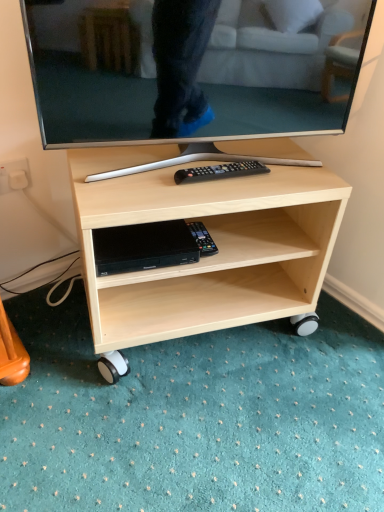
At what (x,y) coordinates should I click in order to perform the action: click on matte black tv at center. Please return your answer as a coordinate pair (x, y). Looking at the image, I should click on (192, 78).

The width and height of the screenshot is (384, 512). What do you see at coordinates (192, 78) in the screenshot?
I see `matte black tv at center` at bounding box center [192, 78].

Describe the element at coordinates (207, 257) in the screenshot. I see `light wood/texture tv stand at center` at that location.

Identify the location of black plastic dvd player at lower center. (143, 247).

Locate an element on the screen. This screenshot has height=512, width=384. matte black tv at center is located at coordinates (192, 78).

Is black plastic dvd player at lower center in front of light wood/texture tv stand at center?

No, the depth of black plastic dvd player at lower center is greater than that of light wood/texture tv stand at center.

Which of these two, black plastic dvd player at lower center or light wood/texture tv stand at center, is bigger?

With larger size is light wood/texture tv stand at center.

Which is more to the left, black plastic dvd player at lower center or light wood/texture tv stand at center?

From the viewer's perspective, black plastic dvd player at lower center appears more on the left side.

Is black plastic remote control at center positioned far away from light wood/texture tv stand at center?

No, there isn't a large distance between black plastic remote control at center and light wood/texture tv stand at center.

From the image's perspective, is black plastic remote control at center on top of light wood/texture tv stand at center?

Yes, from the image's perspective, black plastic remote control at center is over light wood/texture tv stand at center.

Which object is more forward, black plastic remote control at center or light wood/texture tv stand at center?

light wood/texture tv stand at center.

Looking at this image, how many degrees apart are the facing directions of black plastic remote control at center and light wood/texture tv stand at center?

The angle between the facing direction of black plastic remote control at center and the facing direction of light wood/texture tv stand at center is 0.000186 degrees.

Which is behind, point (305, 252) or point (103, 251)?

The point (305, 252) is farther from the camera.

Which is in front, light wood/texture tv stand at center or black plastic dvd player at lower center?

light wood/texture tv stand at center is closer to the camera.

Can you confirm if light wood/texture tv stand at center is shorter than black plastic dvd player at lower center?

In fact, light wood/texture tv stand at center may be taller than black plastic dvd player at lower center.

Which object is further away from the camera taking this photo, light wood/texture tv stand at center or matte black tv at center?

Positioned behind is light wood/texture tv stand at center.

Is matte black tv at center at the back of light wood/texture tv stand at center?

No, matte black tv at center is not at the back of light wood/texture tv stand at center.

What's the angular difference between light wood/texture tv stand at center and matte black tv at center's facing directions?

There is a 3.55-degree angle between the facing directions of light wood/texture tv stand at center and matte black tv at center.

Which is closer to the camera, (140, 178) or (110, 126)?

The point (140, 178) is closer to the camera.

Is black plastic remote at center inside or outside of light wood/texture tv stand at center?

black plastic remote at center is inside light wood/texture tv stand at center.

Could you tell me if black plastic remote at center is facing light wood/texture tv stand at center?

Yes, black plastic remote at center is turned towards light wood/texture tv stand at center.

From the image's perspective, is black plastic remote at center located beneath light wood/texture tv stand at center?

Incorrect, from the image's perspective, black plastic remote at center is higher than light wood/texture tv stand at center.

Which object is further away from the camera, matte black tv at center or black plastic dvd player at lower center?

black plastic dvd player at lower center is more distant.

Which point is more forward, (45, 8) or (172, 237)?

The point (45, 8) is more forward.

Is matte black tv at center next to black plastic dvd player at lower center and touching it?

There is a gap between matte black tv at center and black plastic dvd player at lower center.

Is matte black tv at center positioned beyond the bounds of black plastic dvd player at lower center?

Yes, matte black tv at center is located beyond the bounds of black plastic dvd player at lower center.

From a real-world perspective, is matte black tv at center located beneath black plastic remote at center?

No.

From the image's perspective, which one is positioned lower, matte black tv at center or black plastic remote at center?

black plastic remote at center is shown below in the image.

The height and width of the screenshot is (512, 384). What are the coordinates of `television located above the black plastic remote at center (from the image's perspective)` in the screenshot? It's located at (192, 78).

Locate an element on the screen. This screenshot has width=384, height=512. gadget lying on the left of light wood/texture tv stand at center is located at coordinates (143, 247).

Locate an element on the screen. The height and width of the screenshot is (512, 384). desk below the black plastic remote control at center (from a real-world perspective) is located at coordinates (207, 257).

Based on their spatial positions, is black plastic remote control at center or light wood/texture tv stand at center further from black plastic remote at center?

light wood/texture tv stand at center is positioned further to the anchor black plastic remote at center.

Consider the image. Looking at the image, which one is located further to black plastic remote control at center, black plastic dvd player at lower center or black plastic remote at center?

black plastic remote at center is further to black plastic remote control at center.

Which object lies further to the anchor point black plastic remote at center, black plastic dvd player at lower center or matte black tv at center?

matte black tv at center is further to black plastic remote at center.

From the image, which object appears to be nearer to light wood/texture tv stand at center, matte black tv at center or black plastic remote at center?

Based on the image, matte black tv at center appears to be nearer to light wood/texture tv stand at center.

Estimate the real-world distances between objects in this image. Which object is further from black plastic remote control at center, light wood/texture tv stand at center or black plastic dvd player at lower center?

The object further to black plastic remote control at center is light wood/texture tv stand at center.

Based on their spatial positions, is black plastic remote control at center or matte black tv at center further from black plastic remote at center?

Based on the image, matte black tv at center appears to be further to black plastic remote at center.

Considering their positions, is black plastic remote at center positioned closer to black plastic dvd player at lower center than light wood/texture tv stand at center?

light wood/texture tv stand at center.

Based on their spatial positions, is black plastic remote at center or light wood/texture tv stand at center further from black plastic remote control at center?

light wood/texture tv stand at center is positioned further to the anchor black plastic remote control at center.

Where is `equipment between black plastic dvd player at lower center and black plastic remote at center from left to right`? Image resolution: width=384 pixels, height=512 pixels. equipment between black plastic dvd player at lower center and black plastic remote at center from left to right is located at coordinates (202, 239).

Identify the location of desk between black plastic dvd player at lower center and black plastic remote at center. This screenshot has width=384, height=512. (207, 257).

Where is `remote that lies between matte black tv at center and light wood/texture tv stand at center from top to bottom`? Image resolution: width=384 pixels, height=512 pixels. remote that lies between matte black tv at center and light wood/texture tv stand at center from top to bottom is located at coordinates (220, 172).

You are a GUI agent. You are given a task and a screenshot of the screen. Output one action in this format:
    pyautogui.click(x=<x>, y=<y>)
    Task: Click on the remote between matte black tv at center and black plastic remote control at center in the up-down direction
    
    Given the screenshot: What is the action you would take?
    pyautogui.click(x=220, y=172)